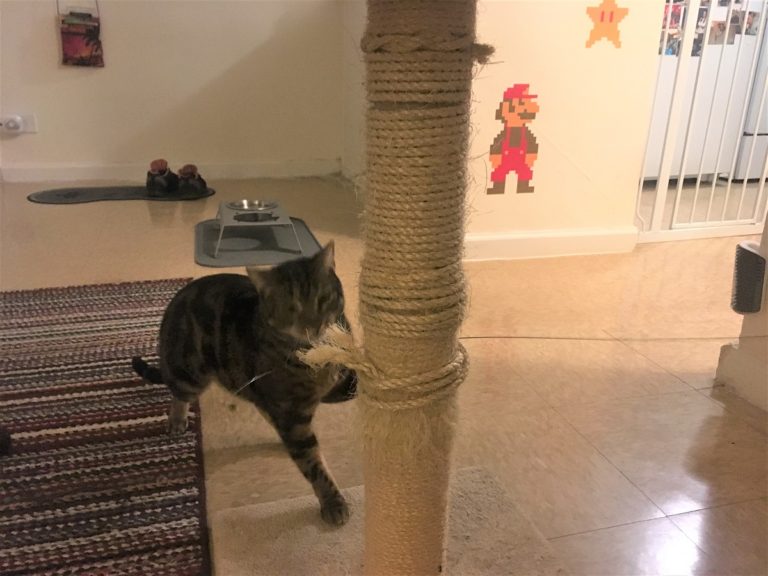
I want to click on wall, so click(561, 130), click(250, 113).